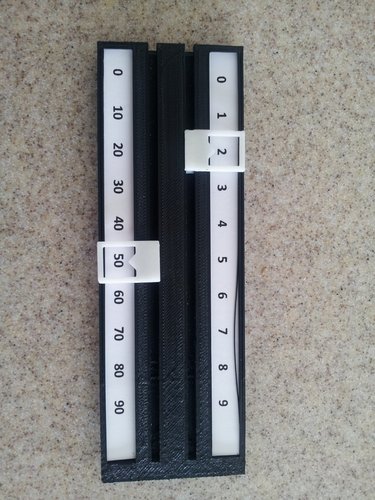
This screenshot has height=500, width=375. Find the location of `black frame`. black frame is located at coordinates click(x=169, y=106).